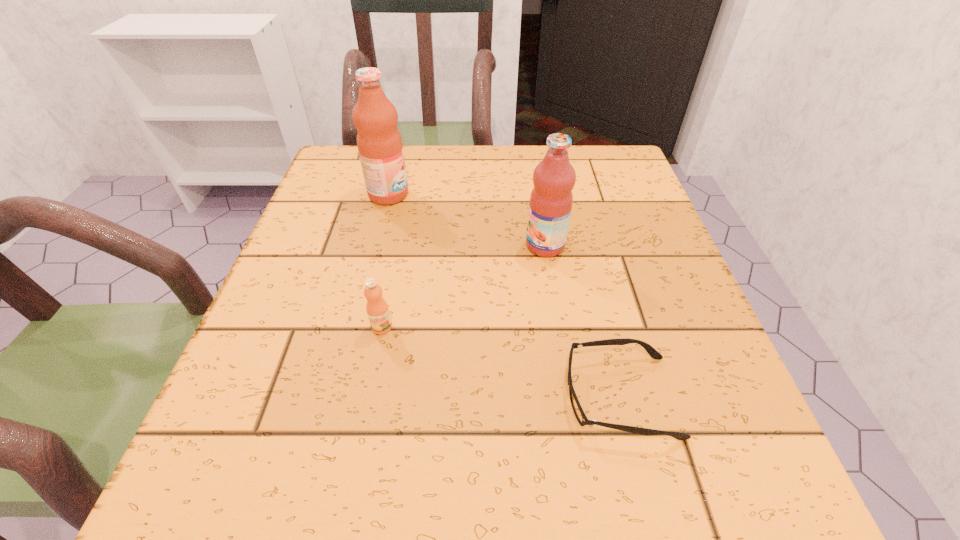
Locate an element on the screen. This screenshot has width=960, height=540. free space at the far edge of the desktop is located at coordinates (448, 165).

This screenshot has height=540, width=960. In the image, there is a desktop. What are the coordinates of `free region at the near edge` in the screenshot? It's located at (631, 500).

In the image, there is a desktop. In order to click on vacant space at the left edge in this screenshot , I will do `click(333, 228)`.

What are the coordinates of `free point at the right edge` in the screenshot? It's located at (673, 422).

In the image, there is a desktop. At what (x,y) coordinates should I click in order to perform the action: click on blank space at the far left corner. Please return your answer as a coordinate pair (x, y). This screenshot has width=960, height=540. Looking at the image, I should click on (358, 167).

This screenshot has width=960, height=540. In the image, there is a desktop. Identify the location of vacant area at the near left corner. (263, 508).

Image resolution: width=960 pixels, height=540 pixels. In order to click on vacant space at the far right corner in this screenshot , I will do `click(588, 186)`.

Identify the location of vacant space at the near right corner of the desktop. (708, 470).

Identify the location of vacant area that lies between the orange juice and the farther fruit juice. This screenshot has height=540, width=960. (385, 261).

The width and height of the screenshot is (960, 540). In order to click on free space that is in between the shortest object and the farther fruit juice in this screenshot , I will do `click(504, 295)`.